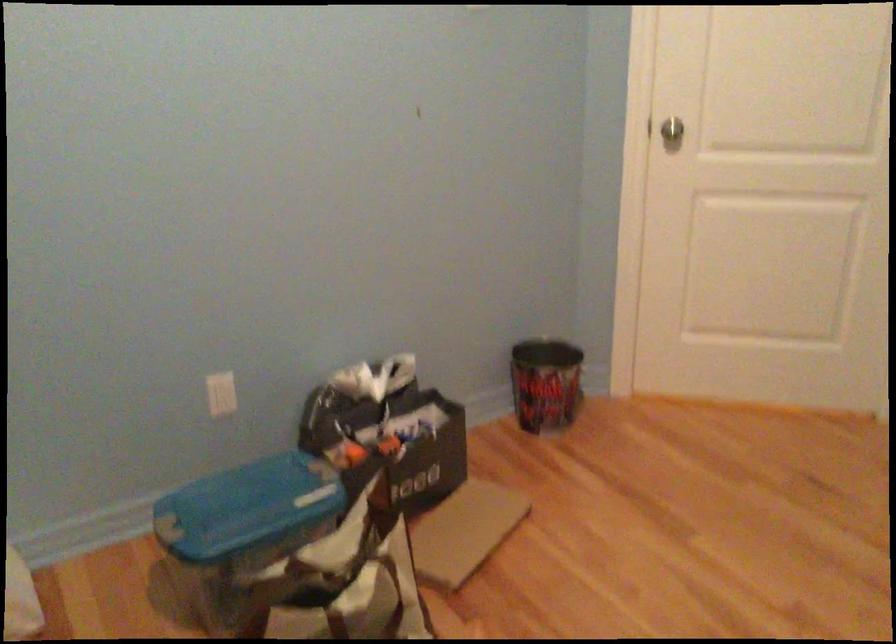
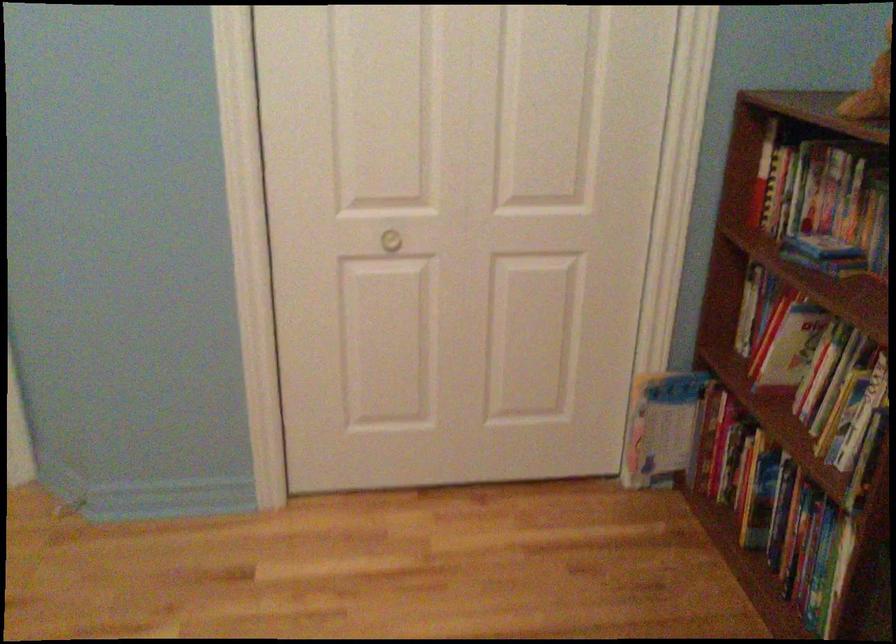
Question: The camera is either moving clockwise (left) or counter-clockwise (right) around the object. The first image is from the beginning of the video and the second image is from the end. Is the camera moving left or right when shooting the video?

Choices:
 (A) Left
 (B) Right

Answer: (A)